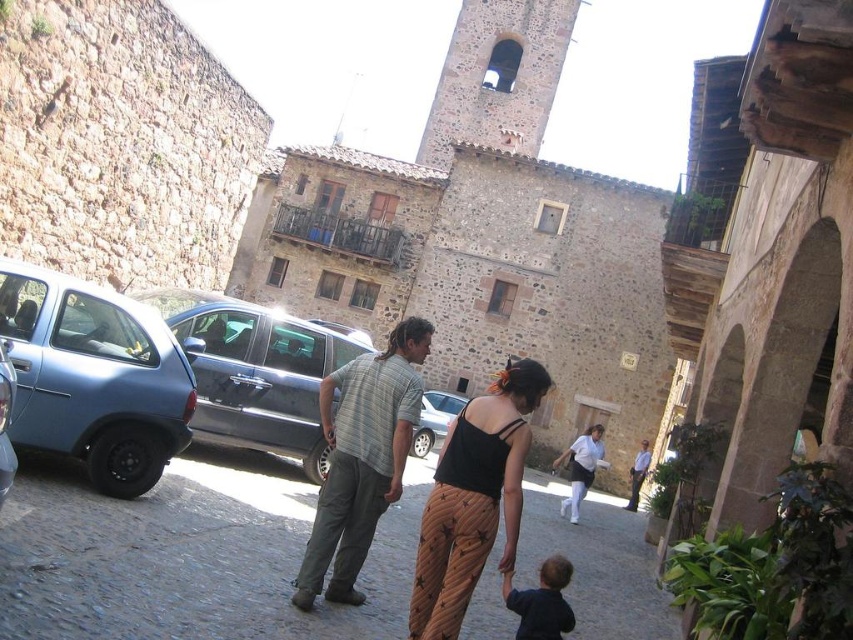
Question: Which object appears closest to the camera in this image?

Choices:
 (A) dark blue fabric at lower center
 (B) gray striped shirt at center
 (C) metallic silver car at center

Answer: (A)

Question: Which point appears closest to the camera in this image?

Choices:
 (A) (578, 461)
 (B) (169, 300)
 (C) (401, 356)

Answer: (C)

Question: Does matte blue car at left have a larger size compared to light blue shirt at center?

Choices:
 (A) no
 (B) yes

Answer: (B)

Question: Observing the image, what is the correct spatial positioning of matte blue car at left in reference to matte black tank top at center?

Choices:
 (A) left
 (B) right

Answer: (A)

Question: Which point is closer to the camera taking this photo?

Choices:
 (A) (125, 483)
 (B) (451, 428)
 (C) (531, 609)

Answer: (C)

Question: Can you confirm if gray striped shirt at center is bigger than matte black tank top at center?

Choices:
 (A) no
 (B) yes

Answer: (B)